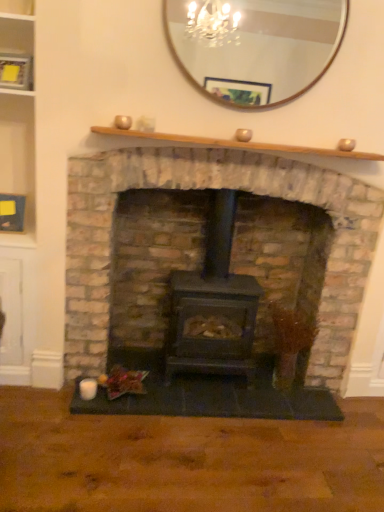
Question: Is point (195, 71) closer or farther from the camera than point (336, 260)?

Choices:
 (A) closer
 (B) farther

Answer: (A)

Question: Is wooden mirror at upper center spatially inside matte black wood stove at center, or outside of it?

Choices:
 (A) outside
 (B) inside

Answer: (A)

Question: Which of these objects is positioned closest to the wooden shelf at upper center?

Choices:
 (A) black matte wood burning stove at center
 (B) wooden mirror at upper center
 (C) matte black wood stove at center

Answer: (C)

Question: Which of these objects is positioned closest to the black matte wood burning stove at center?

Choices:
 (A) wooden shelf at upper center
 (B) wooden mirror at upper center
 (C) matte black wood stove at center

Answer: (C)